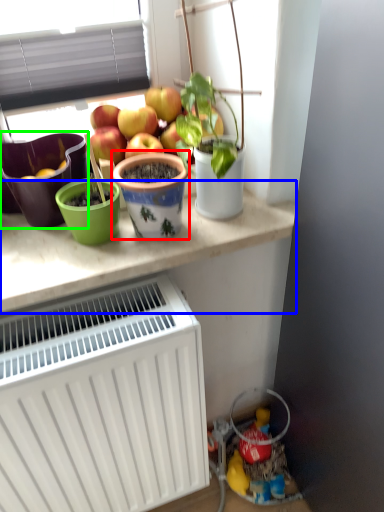
Question: Considering the real-world distances, which object is closest to flowerpot (highlighted by a red box)? table (highlighted by a blue box) or flowerpot (highlighted by a green box).

Choices:
 (A) table
 (B) flowerpot

Answer: (A)